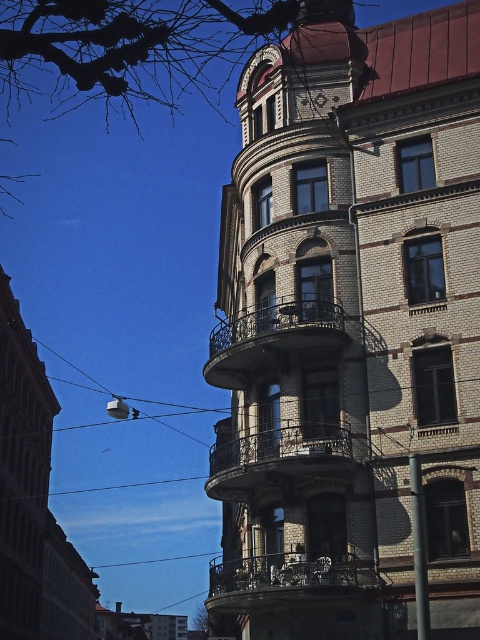
Question: Does dark brown wrought iron balcony at center have a greater width compared to metallic wrought iron balcony at center?

Choices:
 (A) no
 (B) yes

Answer: (A)

Question: Which point is closer to the camera?

Choices:
 (A) metallic wrought iron balcony at center
 (B) white ceramic clock at upper center

Answer: (A)

Question: Does metallic wrought iron balcony at center have a greater width compared to white ceramic clock at upper center?

Choices:
 (A) yes
 (B) no

Answer: (A)

Question: Which is farther from the metallic wrought iron balcony at center?

Choices:
 (A) white ceramic clock at upper center
 (B) dark brown wrought iron balcony at center

Answer: (A)

Question: Which point is closer to the camera?

Choices:
 (A) dark brown wrought iron balcony at center
 (B) white ceramic clock at upper center

Answer: (A)

Question: Considering the relative positions of dark brown wrought iron balcony at center and metallic wrought iron balcony at center in the image provided, where is dark brown wrought iron balcony at center located with respect to metallic wrought iron balcony at center?

Choices:
 (A) below
 (B) above

Answer: (B)